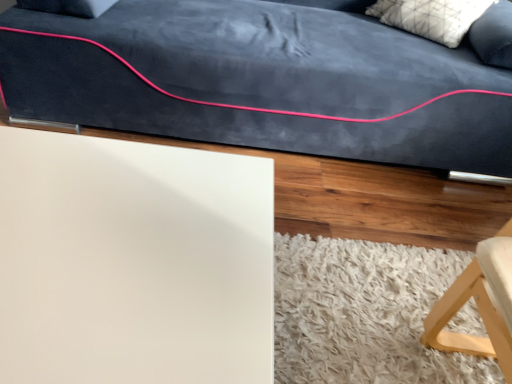
Question: Is white matte board at lower left oriented away from white shaggy rug at lower right?

Choices:
 (A) yes
 (B) no

Answer: (B)

Question: Is white matte board at lower left at the left side of white shaggy rug at lower right?

Choices:
 (A) no
 (B) yes

Answer: (B)

Question: Would you say white matte board at lower left is outside white shaggy rug at lower right?

Choices:
 (A) yes
 (B) no

Answer: (A)

Question: Does white matte board at lower left have a larger size compared to white shaggy rug at lower right?

Choices:
 (A) yes
 (B) no

Answer: (A)

Question: Is white matte board at lower left not close to white shaggy rug at lower right?

Choices:
 (A) yes
 (B) no

Answer: (B)

Question: From their relative heights in the image, would you say white textured pillow at upper right is taller or shorter than white shaggy rug at lower right?

Choices:
 (A) short
 (B) tall

Answer: (B)

Question: Considering the positions of white textured pillow at upper right and white shaggy rug at lower right in the image, is white textured pillow at upper right wider or thinner than white shaggy rug at lower right?

Choices:
 (A) wide
 (B) thin

Answer: (B)

Question: Do you think white textured pillow at upper right is within white shaggy rug at lower right, or outside of it?

Choices:
 (A) inside
 (B) outside

Answer: (B)

Question: In the image, is white textured pillow at upper right positioned in front of or behind white shaggy rug at lower right?

Choices:
 (A) front
 (B) behind

Answer: (B)

Question: Does point (285, 324) appear closer or farther from the camera than point (94, 248)?

Choices:
 (A) closer
 (B) farther

Answer: (B)

Question: From the image's perspective, is white shaggy rug at lower right located above or below white matte board at lower left?

Choices:
 (A) above
 (B) below

Answer: (B)

Question: In terms of size, does white shaggy rug at lower right appear bigger or smaller than white matte board at lower left?

Choices:
 (A) small
 (B) big

Answer: (A)

Question: In terms of width, does white shaggy rug at lower right look wider or thinner when compared to white matte board at lower left?

Choices:
 (A) wide
 (B) thin

Answer: (A)

Question: Is white textured pillow at upper right wider or thinner than white matte board at lower left?

Choices:
 (A) thin
 (B) wide

Answer: (A)

Question: In the image, is white textured pillow at upper right positioned in front of or behind white matte board at lower left?

Choices:
 (A) front
 (B) behind

Answer: (B)